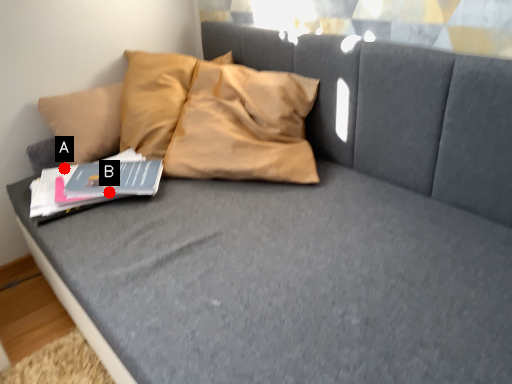
Question: Two points are circled on the image, labeled by A and B beside each circle. Which point appears farthest from the camera in this image?

Choices:
 (A) A is further
 (B) B is further

Answer: (A)